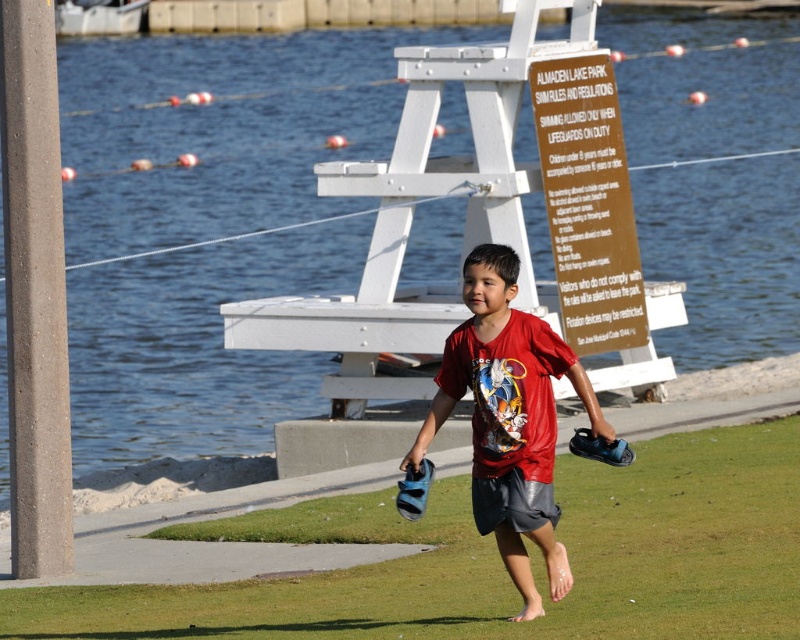
Does brown wooden sign at upper center lie in front of dark gray cotton shorts at center?

That is False.

Who is lower down, brown wooden sign at upper center or dark gray cotton shorts at center?

dark gray cotton shorts at center

Does point (558, 172) come in front of point (541, 513)?

No, it is not.

Locate an element on the screen. brown wooden sign at upper center is located at coordinates (588, 204).

From the picture: Measure the distance from green grass at center to red matte shirt at center.

A distance of 5.31 feet exists between green grass at center and red matte shirt at center.

Between green grass at center and red matte shirt at center, which one appears on the left side from the viewer's perspective?

green grass at center is more to the left.

Where is `green grass at center`? This screenshot has width=800, height=640. green grass at center is located at coordinates (498, 561).

Is green grass at center smaller than dark gray cotton shorts at center?

Indeed, green grass at center has a smaller size compared to dark gray cotton shorts at center.

Which is in front, point (568, 611) or point (548, 518)?

Point (568, 611) is more forward.

I want to click on green grass at center, so click(x=498, y=561).